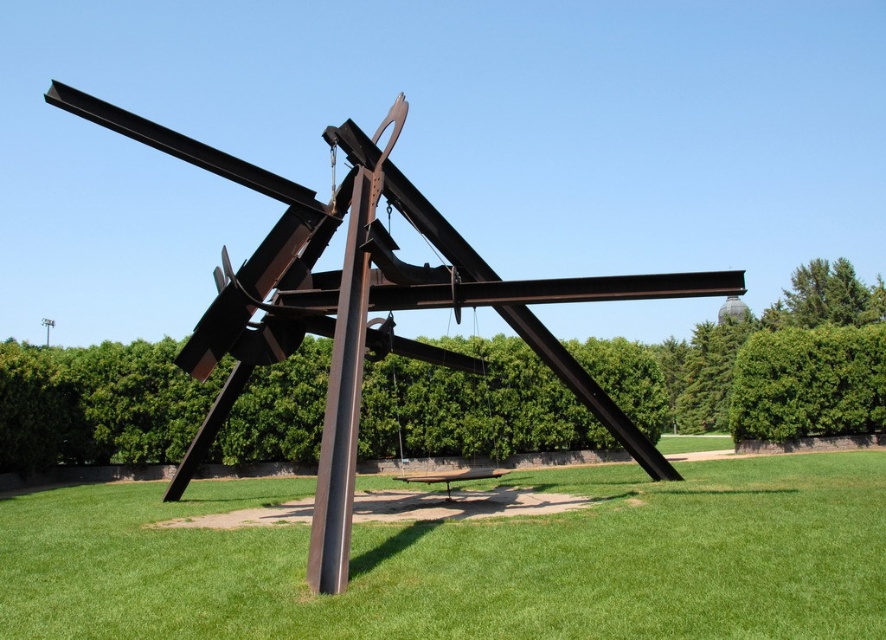
You are a landscape architect planning to place a new bench in the garden. The bench requires a flat area larger than the green grass at center. Based on the scene, can you determine if there is enough space near the rustic metal sculpture at center for the bench?

The green grass at center is smaller than the rustic metal sculpture at center. Since the bench requires a flat area larger than the green grass at center, there may not be enough space near the rustic metal sculpture at center as the grass area is insufficient in size.

You are a landscape architect designing a garden path that needs to pass between the green grass at center and the rustic metal sculpture at center. Based on their widths, which one should the path be closer to?

The path should be closer to the rustic metal sculpture at center because the green grass at center is wider than the rustic metal sculpture at center, so there is more space on the grass side.

Based on the photo, you are standing on the green grass at center and want to walk to the rustic metal sculpture at center. Which direction should you move to reach it?

Since the green grass at center is to the right of the rustic metal sculpture at center, you should move to the left to reach the sculpture.